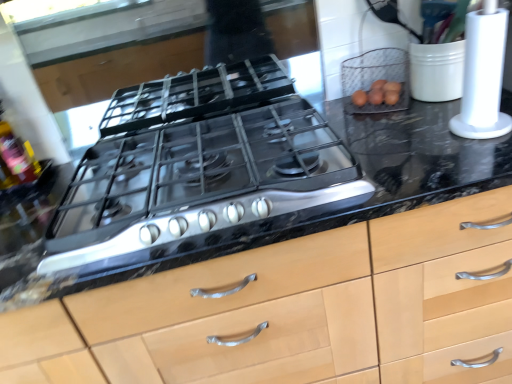
Find the location of `vacant point to the left of wire mesh basket at upper right`. vacant point to the left of wire mesh basket at upper right is located at coordinates (343, 116).